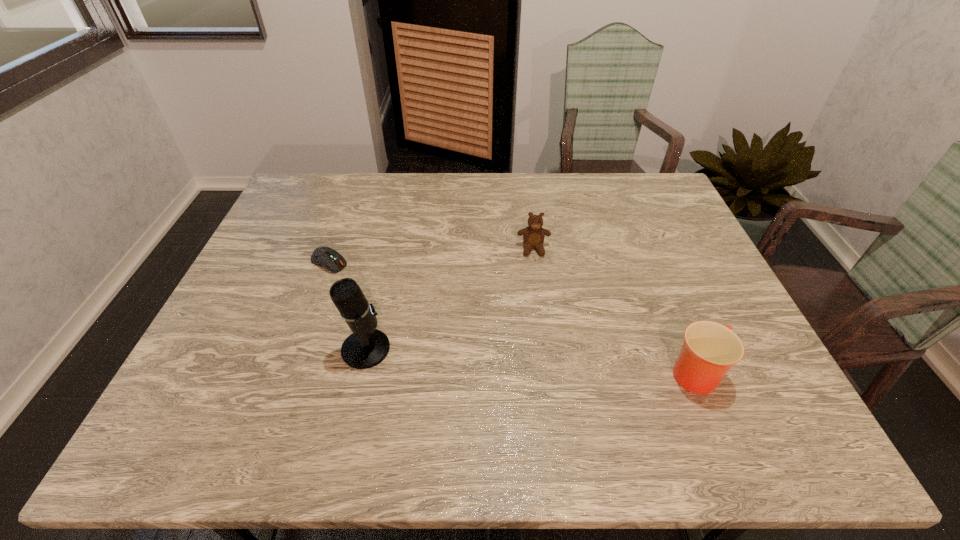
In the image, there is a desktop. Where is `vacant space at the near edge`? The height and width of the screenshot is (540, 960). vacant space at the near edge is located at coordinates (422, 367).

Where is `vacant space at the left edge`? This screenshot has width=960, height=540. vacant space at the left edge is located at coordinates (215, 342).

You are a GUI agent. You are given a task and a screenshot of the screen. Output one action in this format:
    pyautogui.click(x=<x>, y=<y>)
    Task: Click on the free space at the right edge of the desktop
    
    Given the screenshot: What is the action you would take?
    pyautogui.click(x=767, y=364)

Find the location of a particular element. The height and width of the screenshot is (540, 960). vacant space at the far left corner of the desktop is located at coordinates (315, 212).

You are a GUI agent. You are given a task and a screenshot of the screen. Output one action in this format:
    pyautogui.click(x=<x>, y=<y>)
    Task: Click on the vacant area at the near left corner
    This screenshot has height=540, width=960.
    Given the screenshot: What is the action you would take?
    pyautogui.click(x=234, y=374)

Identify the location of vacant area at the near right corner of the desktop. Image resolution: width=960 pixels, height=540 pixels. (769, 378).

This screenshot has width=960, height=540. In order to click on blank region between the rightmost object and the third object from right to left in this screenshot , I will do `click(532, 362)`.

Identify the location of empty location between the microphone and the rightmost object. The width and height of the screenshot is (960, 540). (532, 362).

Find the location of a particular element. The image size is (960, 540). vacant space that is in between the third object from right to left and the third object from left to right is located at coordinates (449, 299).

At what (x,y) coordinates should I click in order to perform the action: click on vacant space in between the teddy bear and the rightmost object. Please return your answer as a coordinate pair (x, y). The image size is (960, 540). Looking at the image, I should click on (615, 312).